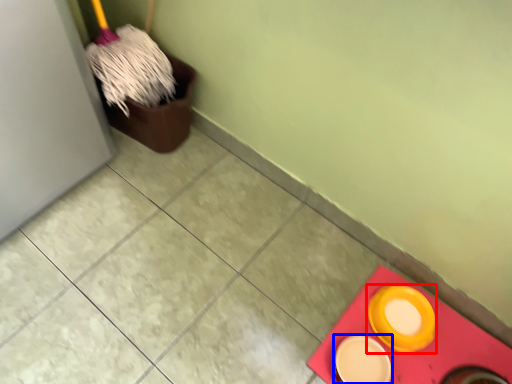
Question: Among these objects, which one is nearest to the camera, tableware (highlighted by a red box) or tableware (highlighted by a blue box)?

Choices:
 (A) tableware
 (B) tableware

Answer: (B)